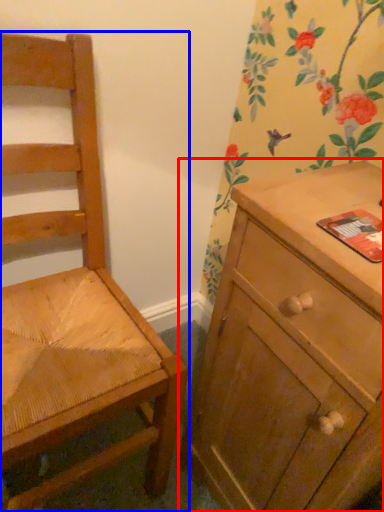
Question: Which object appears closest to the camera in this image, chest of drawers (highlighted by a red box) or chair (highlighted by a blue box)?

Choices:
 (A) chest of drawers
 (B) chair

Answer: (B)